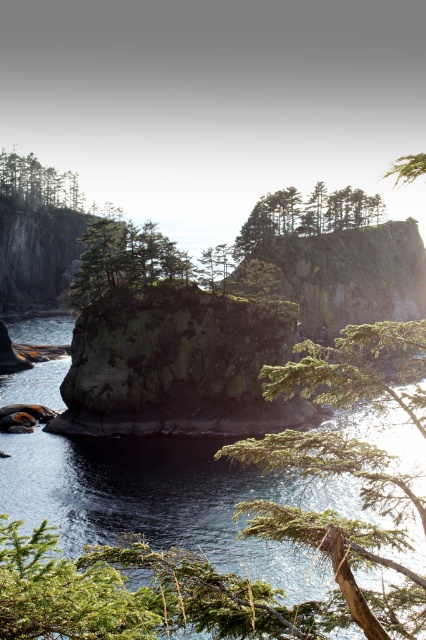
You are a hiker standing on the cliff and you see the dark blue water at center and the green rough tree at center. You want to throw a stone to hit both objects. Is it possible to do so with a single throw?

The dark blue water at center and the green rough tree at center are 48.50 meters apart. Since the distance between them is quite large, it would be challenging to hit both with a single throw unless the stone can travel that far in an arc, but typically, a single throw cannot cover 48.50 meters to reach both objects simultaneously.

You are a hiker standing at the base of the cliffs and see the green textured tree at center and the green matte tree at upper left. Which tree is positioned higher up on the cliff?

The green matte tree at upper left is positioned higher up on the cliff than the green textured tree at center.